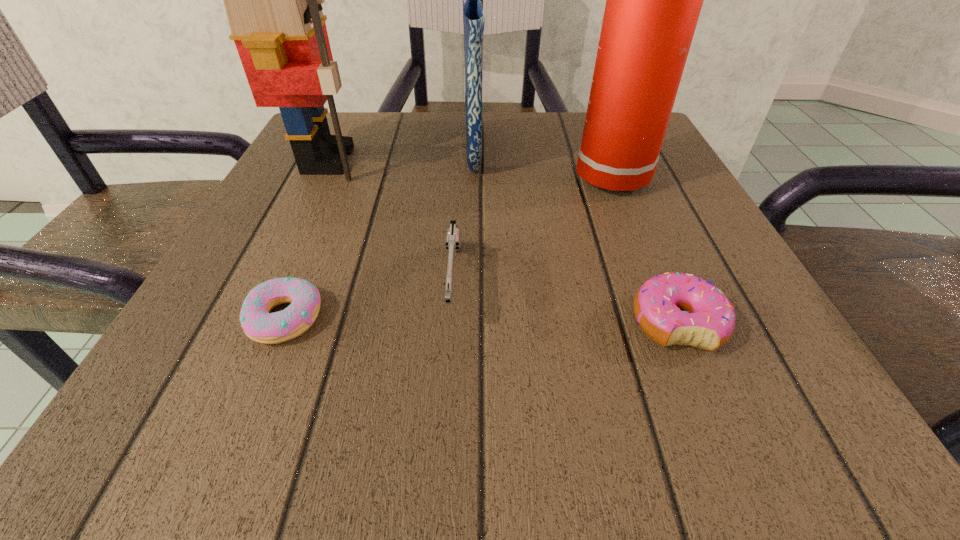
You are a GUI agent. You are given a task and a screenshot of the screen. Output one action in this format:
    pyautogui.click(x=<x>, y=<y>)
    Task: Click on the doughnut that is at the left edge
    This screenshot has height=540, width=960.
    Given the screenshot: What is the action you would take?
    pyautogui.click(x=258, y=324)

Identify the location of fire extinguisher that is at the right edge. (653, 0).

I want to click on doughnut positioned at the right edge, so click(681, 309).

Locate an element on the screen. The width and height of the screenshot is (960, 540). object at the far left corner is located at coordinates (273, 0).

Where is `object present at the far right corner`? object present at the far right corner is located at coordinates (653, 0).

At what (x,y) coordinates should I click in order to perform the action: click on vacant area at the far edge of the desktop. Please return your answer as a coordinate pair (x, y). Image resolution: width=960 pixels, height=540 pixels. Looking at the image, I should click on (x=512, y=147).

Find the location of a particular element. vacant space at the near edge is located at coordinates (558, 429).

Where is `free region at the left edge`? Image resolution: width=960 pixels, height=540 pixels. free region at the left edge is located at coordinates (259, 241).

In the image, there is a desktop. Where is `vacant space at the right edge`? vacant space at the right edge is located at coordinates (683, 232).

Locate an element on the screen. This screenshot has height=540, width=960. vacant region at the near left corner is located at coordinates (234, 369).